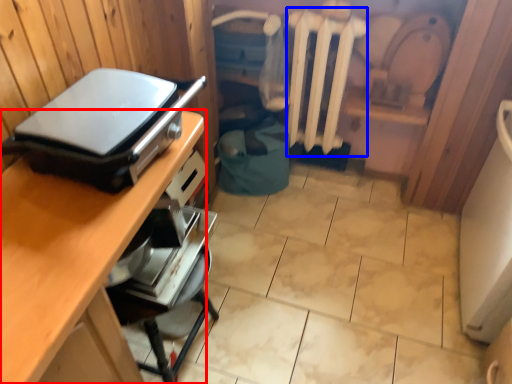
Question: Which point is further to the camera, desk (highlighted by a red box) or radiator (highlighted by a blue box)?

Choices:
 (A) desk
 (B) radiator

Answer: (B)